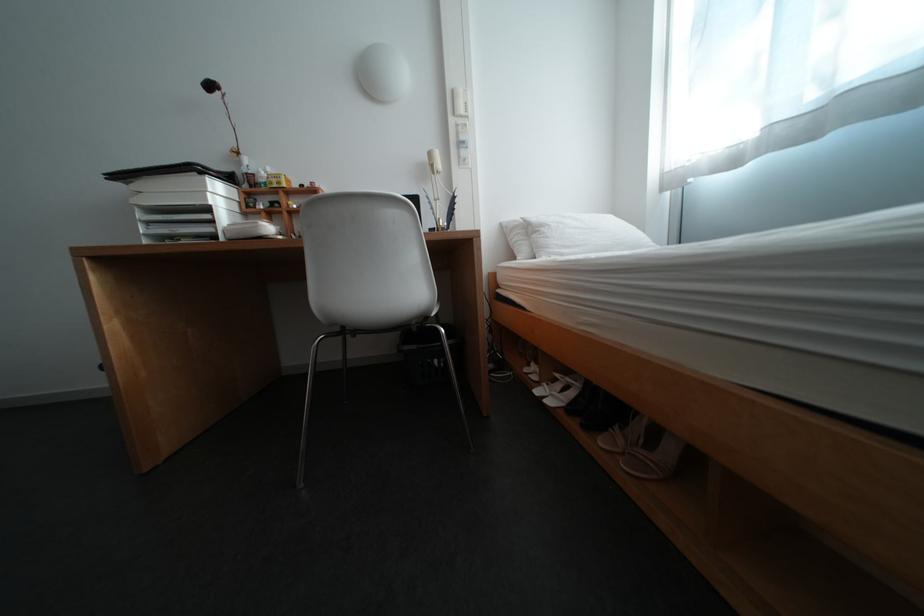
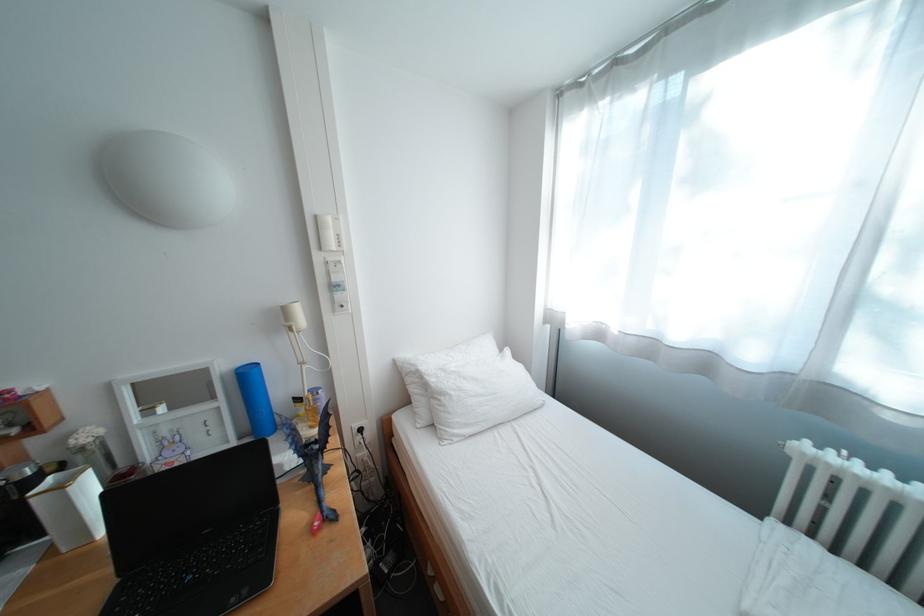
Question: In a continuous first-person perspective shot, in which direction is the camera moving?

Choices:
 (A) Left
 (B) Right
 (C) Forward
 (D) Backward

Answer: (C)